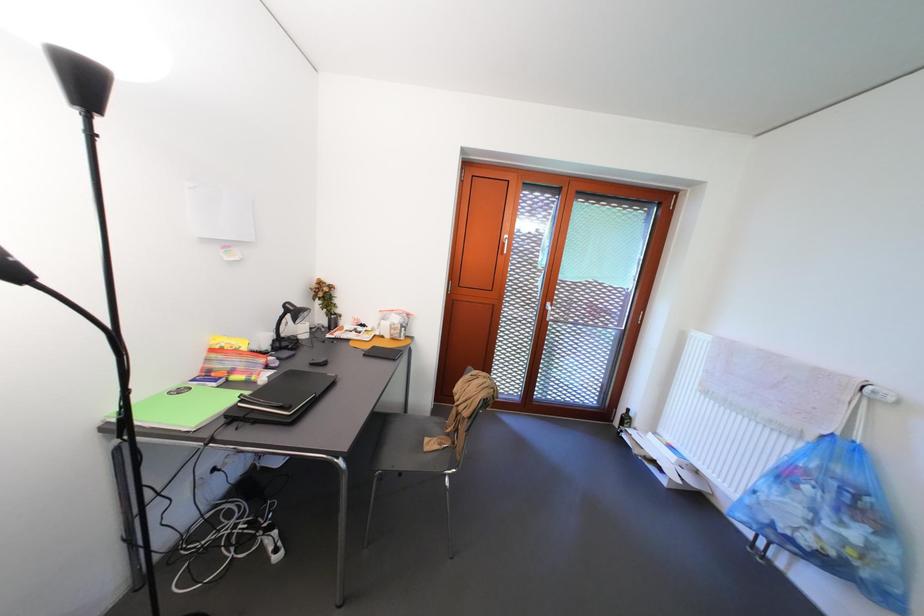
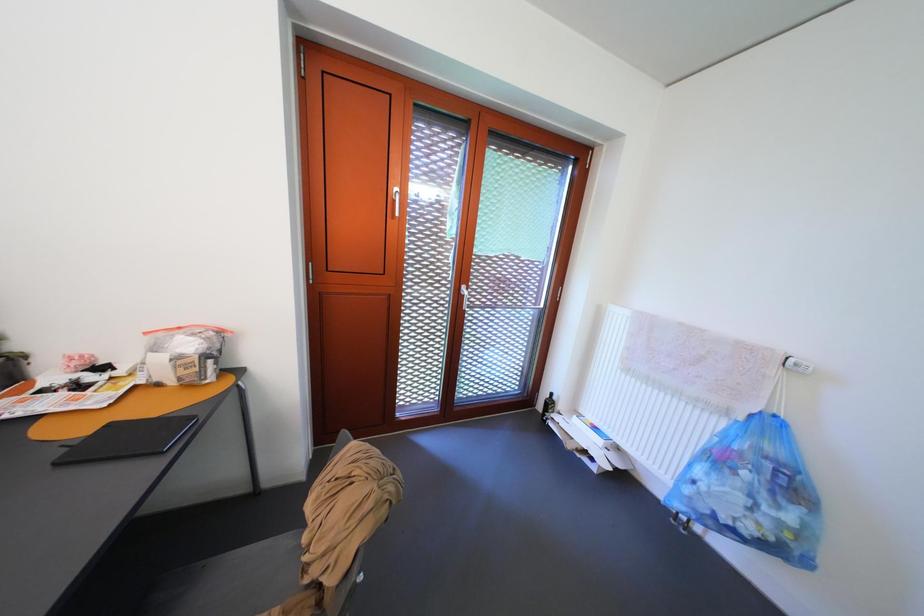
Question: The camera is either moving clockwise (left) or counter-clockwise (right) around the object. The first image is from the beginning of the video and the second image is from the end. Is the camera moving left or right when shooting the video?

Choices:
 (A) Left
 (B) Right

Answer: (A)